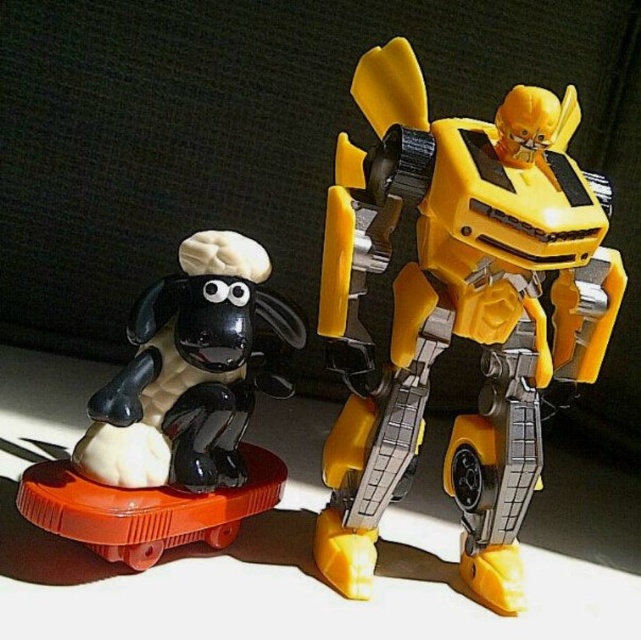
Question: Observing the image, what is the correct spatial positioning of yellow plastic robot at upper right in reference to black glossy sheep at left?

Choices:
 (A) left
 (B) right

Answer: (B)

Question: Which of the following is the farthest from the observer?

Choices:
 (A) yellow plastic robot at upper right
 (B) black glossy sheep at left

Answer: (A)

Question: Which point is closer to the camera taking this photo?

Choices:
 (A) (351, 278)
 (B) (110, 547)

Answer: (B)

Question: Does yellow plastic robot at upper right have a lesser width compared to black glossy sheep at left?

Choices:
 (A) yes
 (B) no

Answer: (B)

Question: Where is yellow plastic robot at upper right located in relation to black glossy sheep at left in the image?

Choices:
 (A) above
 (B) below

Answer: (A)

Question: Among these points, which one is nearest to the camera?

Choices:
 (A) (515, 412)
 (B) (196, 298)

Answer: (B)